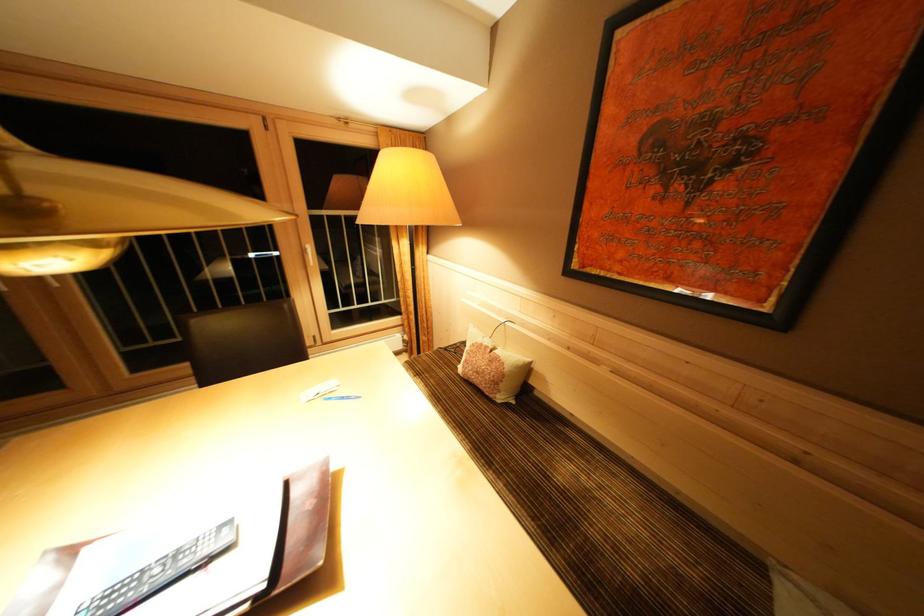
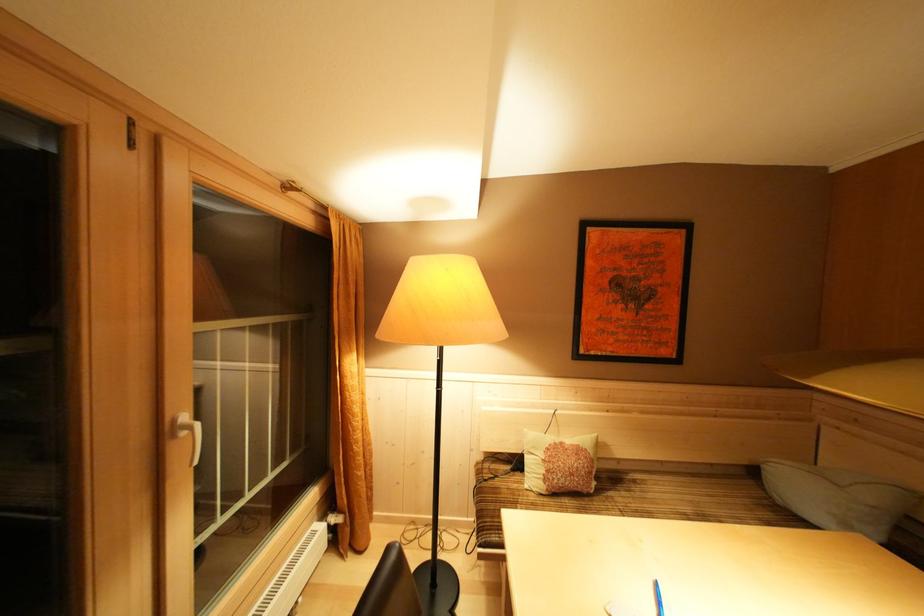
The point at (409, 243) is marked in the first image. Where is the corresponding point in the second image?

(358, 357)